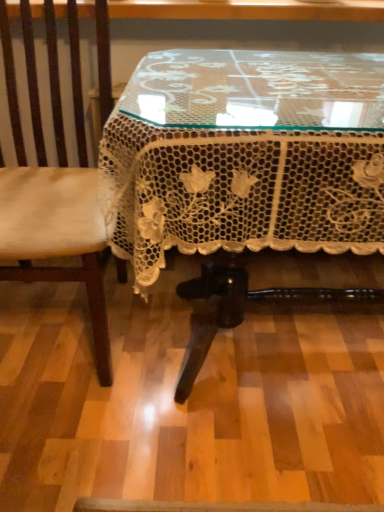
This screenshot has width=384, height=512. What do you see at coordinates (244, 170) in the screenshot?
I see `white lace tablecloth at center` at bounding box center [244, 170].

You are a GUI agent. You are given a task and a screenshot of the screen. Output one action in this format:
    pyautogui.click(x=<x>, y=<y>)
    Task: Click on the white lace tablecloth at center
    The image size is (384, 512).
    Given the screenshot: What is the action you would take?
    pyautogui.click(x=244, y=170)

Find the location of `light brown leather chair at left`. light brown leather chair at left is located at coordinates (53, 185).

What do you see at coordinates (53, 185) in the screenshot? I see `light brown leather chair at left` at bounding box center [53, 185].

Where is `white lace tablecloth at center`? white lace tablecloth at center is located at coordinates (244, 170).

Can you confirm if white lace tablecloth at center is positioned to the right of light brown leather chair at left?

Indeed, white lace tablecloth at center is positioned on the right side of light brown leather chair at left.

Is the position of white lace tablecloth at center more distant than that of light brown leather chair at left?

No, the depth of white lace tablecloth at center is less than that of light brown leather chair at left.

Does point (160, 257) appear closer or farther from the camera than point (84, 212)?

Point (160, 257).

From the image's perspective, relative to light brown leather chair at left, is white lace tablecloth at center above or below?

white lace tablecloth at center is below light brown leather chair at left.

From a real-world perspective, is white lace tablecloth at center over light brown leather chair at left?

No, from a real-world perspective, white lace tablecloth at center is not over light brown leather chair at left

Between white lace tablecloth at center and light brown leather chair at left, which one has larger width?

With larger width is white lace tablecloth at center.

Who is taller, white lace tablecloth at center or light brown leather chair at left?

light brown leather chair at left.

Between white lace tablecloth at center and light brown leather chair at left, which one has larger size?

Bigger between the two is white lace tablecloth at center.

Is white lace tablecloth at center not within light brown leather chair at left?

Absolutely, white lace tablecloth at center is external to light brown leather chair at left.

Is white lace tablecloth at center next to light brown leather chair at left?

They are not placed beside each other.

Is light brown leather chair at left at the back of white lace tablecloth at center?

white lace tablecloth at center does not have its back to light brown leather chair at left.

In the scene shown: Measure the distance from white lace tablecloth at center to light brown leather chair at left.

33.35 centimeters.

At what (x,y) coordinates should I click in order to perform the action: click on table to the right of light brown leather chair at left. Please return your answer as a coordinate pair (x, y). The width and height of the screenshot is (384, 512). Looking at the image, I should click on (244, 170).

Would you say light brown leather chair at left is to the left or to the right of white lace tablecloth at center in the picture?

light brown leather chair at left is positioned on white lace tablecloth at center's left side.

Considering their positions, is light brown leather chair at left located in front of or behind white lace tablecloth at center?

In the image, light brown leather chair at left appears behind white lace tablecloth at center.

Is point (102, 49) farther from viewer compared to point (338, 248)?

Yes, point (102, 49) is farther from viewer.

From the image's perspective, does light brown leather chair at left appear lower than white lace tablecloth at center?

Incorrect, from the image's perspective, light brown leather chair at left is higher than white lace tablecloth at center.

From a real-world perspective, is light brown leather chair at left physically located above or below white lace tablecloth at center?

Clearly, from a real-world perspective, light brown leather chair at left is above white lace tablecloth at center.

Considering the relative sizes of light brown leather chair at left and white lace tablecloth at center in the image provided, is light brown leather chair at left thinner than white lace tablecloth at center?

Yes.

Is light brown leather chair at left taller than white lace tablecloth at center?

Yes.

Between light brown leather chair at left and white lace tablecloth at center, which one has smaller size?

light brown leather chair at left is smaller.

Choose the correct answer: Is light brown leather chair at left inside white lace tablecloth at center or outside it?

light brown leather chair at left is outside white lace tablecloth at center.

Is light brown leather chair at left positioned far away from white lace tablecloth at center?

No, light brown leather chair at left is in close proximity to white lace tablecloth at center.

Could you tell me if light brown leather chair at left is facing white lace tablecloth at center?

No, light brown leather chair at left is not oriented towards white lace tablecloth at center.

In the scene shown: How many degrees apart are the facing directions of light brown leather chair at left and white lace tablecloth at center?

The angular difference between light brown leather chair at left and white lace tablecloth at center is 0.376 degrees.

How far apart are light brown leather chair at left and white lace tablecloth at center?

light brown leather chair at left and white lace tablecloth at center are 13.13 inches apart.

Where is `table on the right of light brown leather chair at left`? The height and width of the screenshot is (512, 384). table on the right of light brown leather chair at left is located at coordinates (244, 170).

At what (x,y) coordinates should I click in order to perform the action: click on chair above the white lace tablecloth at center (from a real-world perspective). Please return your answer as a coordinate pair (x, y). The image size is (384, 512). Looking at the image, I should click on (53, 185).

This screenshot has height=512, width=384. Find the location of `chair that is behind the white lace tablecloth at center`. chair that is behind the white lace tablecloth at center is located at coordinates (53, 185).